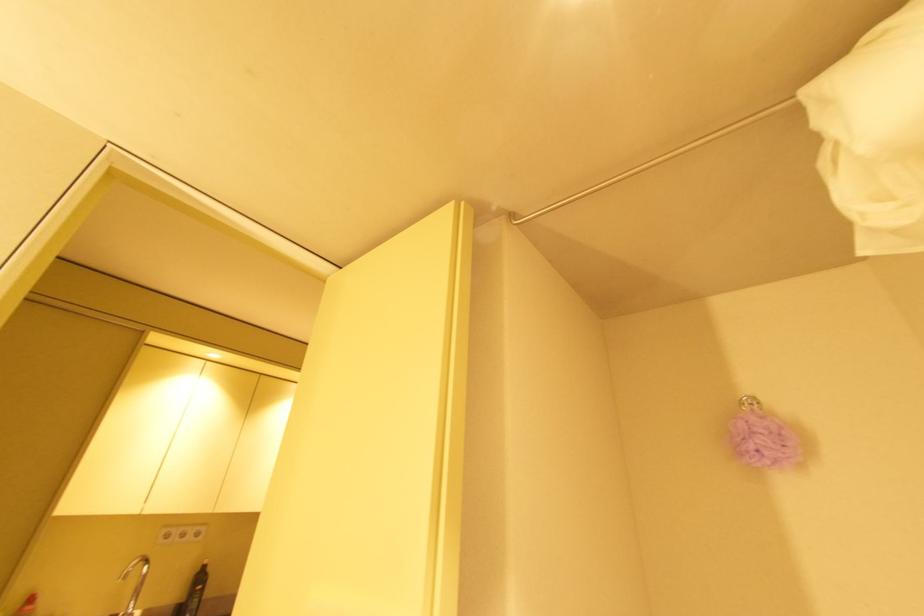
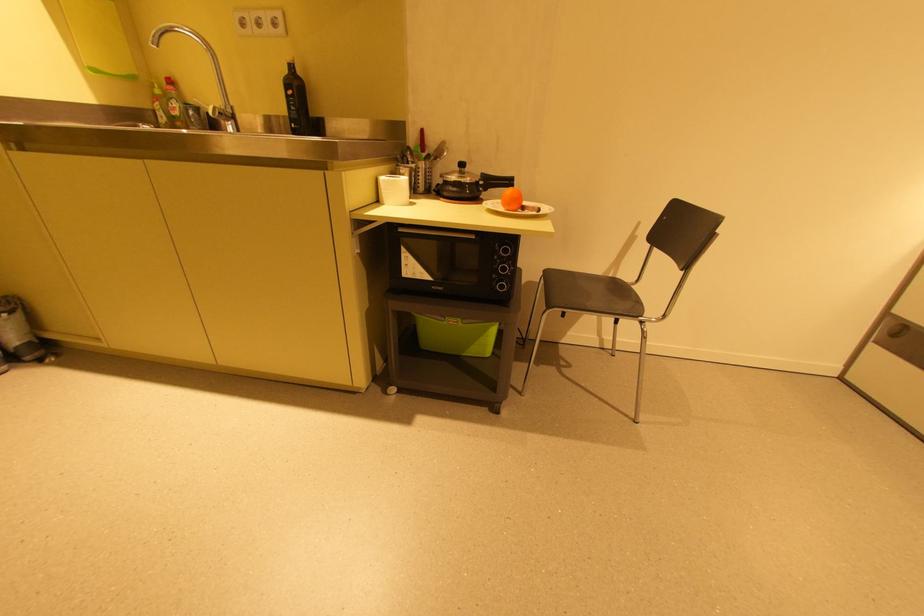
The point at (204,570) is marked in the first image. Where is the corresponding point in the second image?

(289, 71)